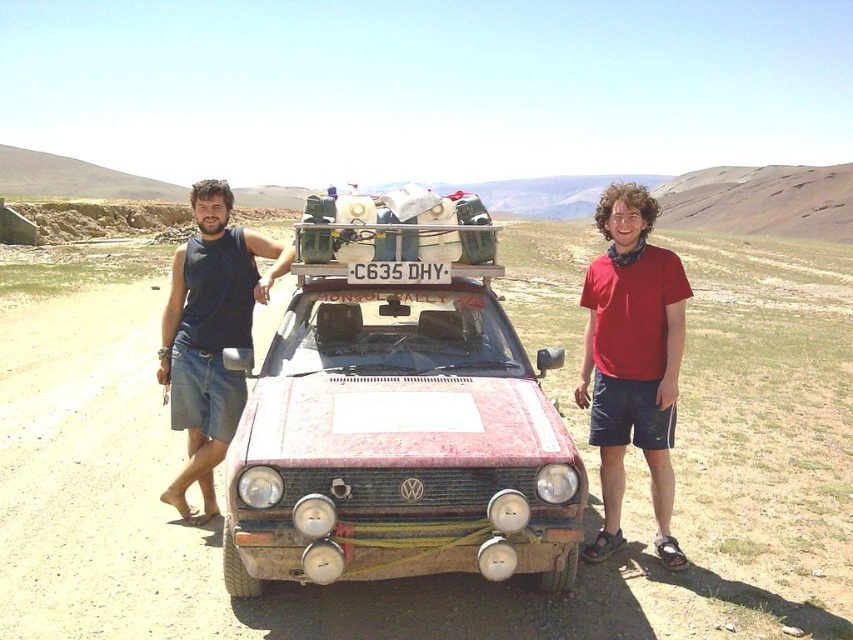
You are a photographer positioned at the center of the image. You need to capture a photo that includes both the red cotton shirt at center and the black cotton tank top at left. What is the minimum distance you need to move backward to ensure both are in frame?

The red cotton shirt at center is 2.77 meters from the black cotton tank top at left. To include both in the frame, you need to move backward at least 2.77 meters to ensure both are visible.

What are the coordinates of the red cotton shirt at center?

The coordinates of the red cotton shirt at center are at point (631, 360).

You are a photographer positioned at the edge of the scene. You need to capture a photo where both the rusty metal car at center and the black cotton tank top at left are visible. Based on their positions, which object should be placed on the right side of the photo frame?

The rusty metal car at center should be placed on the right side of the photo frame because it is to the right of the black cotton tank top at left.